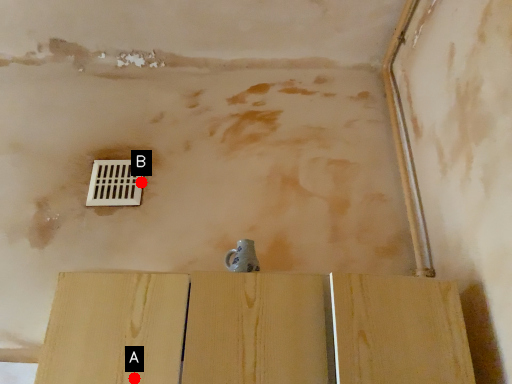
Question: Two points are circled on the image, labeled by A and B beside each circle. Which point appears farthest from the camera in this image?

Choices:
 (A) A is further
 (B) B is further

Answer: (B)